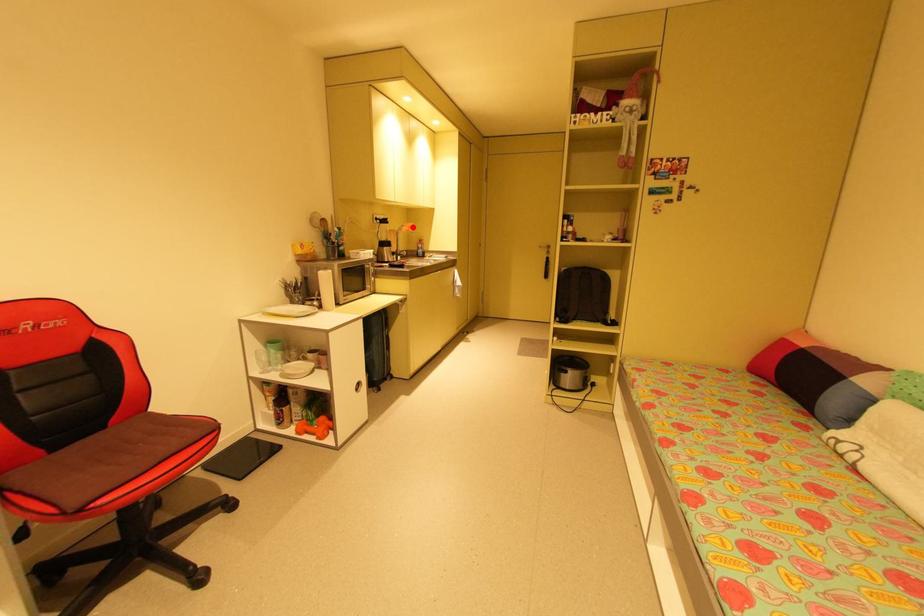
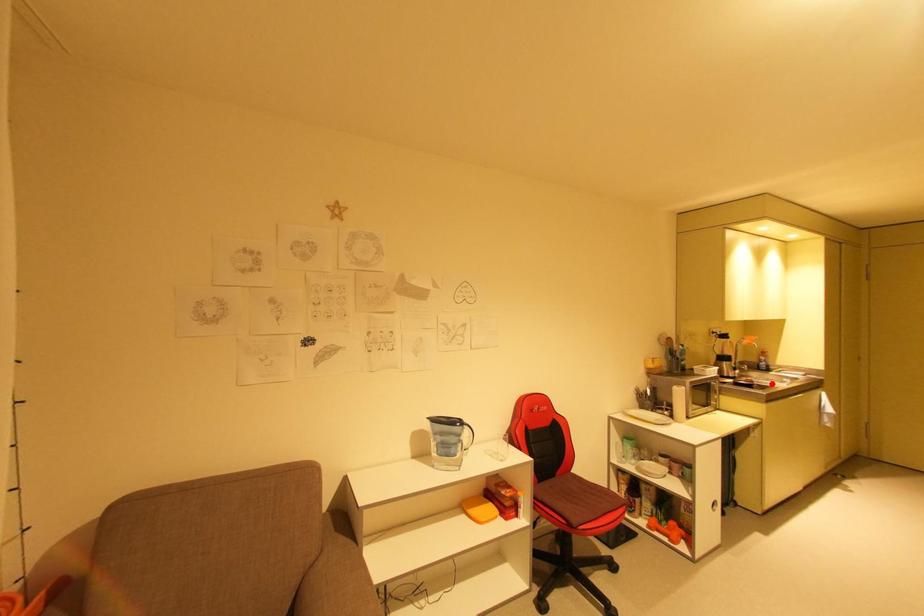
I am providing you with two images of the same scene from different viewpoints. A red point is marked on the first image and another point is marked on the second image. Do the highlighted points in image1 and image2 indicate the same real-world spot?

No